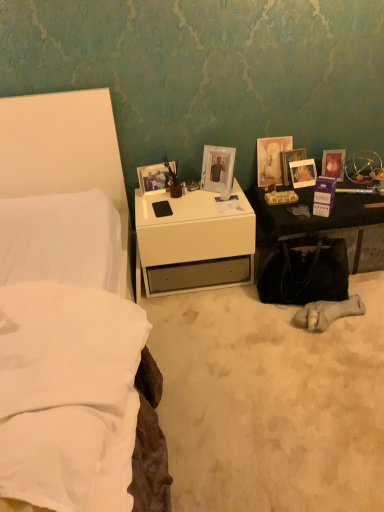
Identify the location of free spot in front of black leather handbag at lower right. (306, 348).